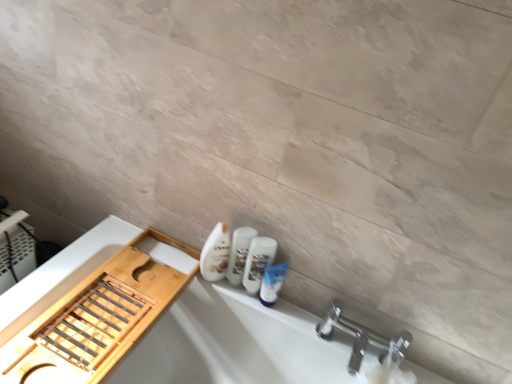
You are a GUI agent. You are given a task and a screenshot of the screen. Output one action in this format:
    pyautogui.click(x=<x>, y=<y>)
    Task: Click on the vacant space to the right of white glossy mouthwash at lower right, which is counted as the 1th mouthwash, starting from the right
    
    Given the screenshot: What is the action you would take?
    pyautogui.click(x=298, y=326)